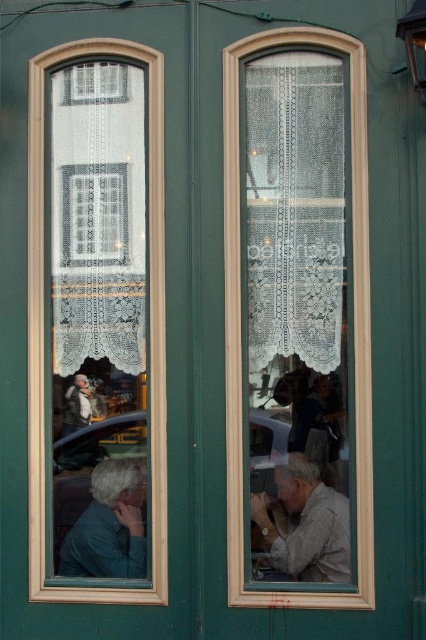
Question: Is clear glass window at left further to the viewer compared to light brown leather jacket at left?

Choices:
 (A) no
 (B) yes

Answer: (A)

Question: From the image, what is the correct spatial relationship of clear glass window at left in relation to light brown fabric shirt at center?

Choices:
 (A) left
 (B) right

Answer: (A)

Question: Can you confirm if white lace curtain at center is positioned above clear glass window at left?

Choices:
 (A) yes
 (B) no

Answer: (A)

Question: Among these objects, which one is farthest from the camera?

Choices:
 (A) light brown leather jacket at left
 (B) white lace curtain at center
 (C) clear glass window at left
 (D) light brown fabric shirt at center

Answer: (A)

Question: Among these points, which one is farthest from the camera?

Choices:
 (A) (334, 35)
 (B) (31, 131)
 (C) (115, 493)

Answer: (C)

Question: Based on their relative distances, which object is nearer to the light brown leather jacket at left?

Choices:
 (A) white lace curtain at center
 (B) light brown fabric shirt at center

Answer: (A)